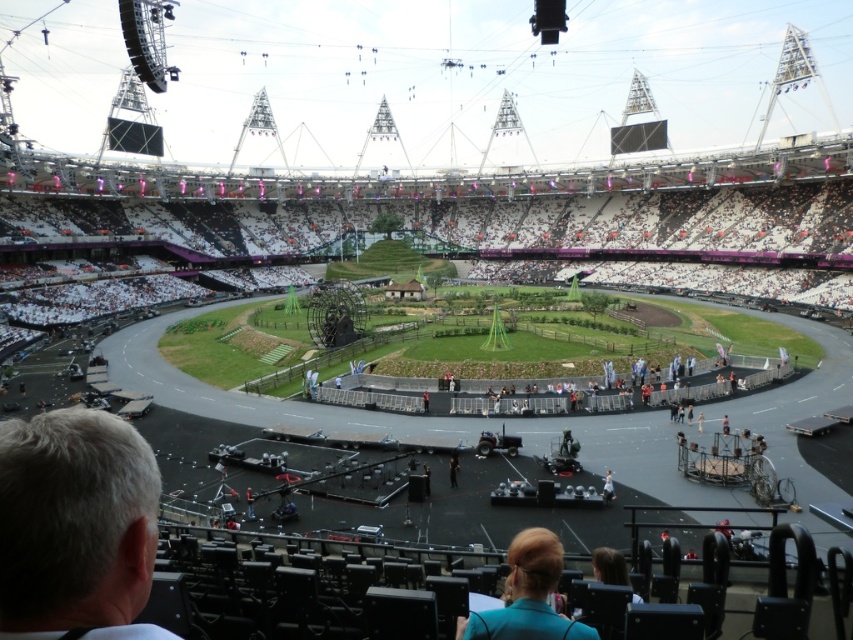
Does green grass at center appear over orange fabric person at center?

Yes, green grass at center is above orange fabric person at center.

Is point (396, 419) closer to camera compared to point (723, 433)?

No, (396, 419) is behind (723, 433).

Who is more distant from viewer, (177, 380) or (726, 424)?

The point (177, 380) is more distant.

The image size is (853, 640). In order to click on green grass at center in this screenshot , I will do `click(412, 419)`.

Which is more to the right, gray hair at lower left or red fabric person at center?

From the viewer's perspective, red fabric person at center appears more on the right side.

Is gray hair at lower left wider than red fabric person at center?

Yes, gray hair at lower left is wider than red fabric person at center.

Does point (39, 497) lie behind point (425, 396)?

No, it is not.

This screenshot has width=853, height=640. I want to click on gray hair at lower left, so click(76, 525).

Is dark blue suit at center above red fabric person at center?

Actually, dark blue suit at center is below red fabric person at center.

Is point (427, 468) closer to viewer compared to point (427, 397)?

Yes, point (427, 468) is closer to viewer.

Locate an element on the screen. dark blue suit at center is located at coordinates point(426,480).